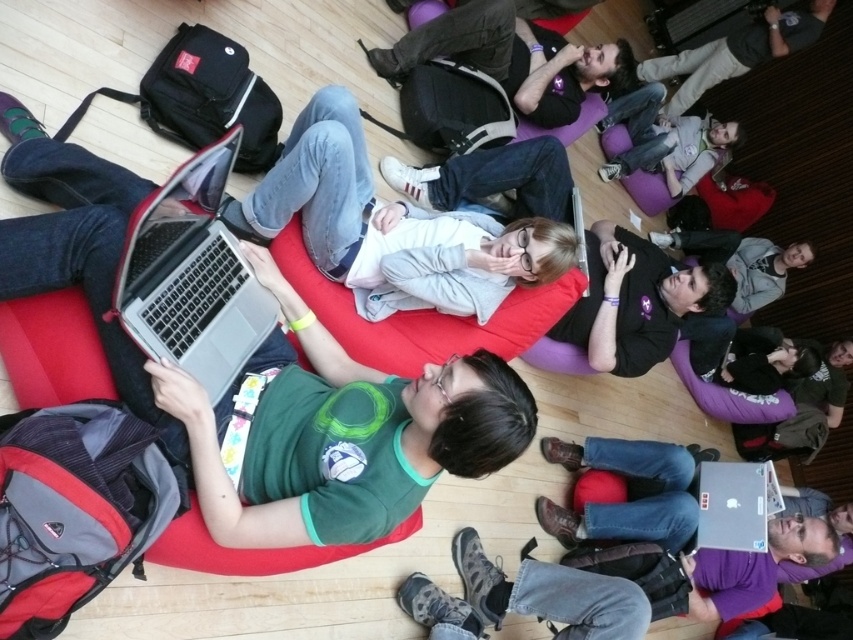
Is matte gray sweater at center closer to the viewer compared to dark gray fabric jacket at upper right?

That is True.

Can you confirm if matte gray sweater at center is positioned below dark gray fabric jacket at upper right?

Yes, matte gray sweater at center is below dark gray fabric jacket at upper right.

You are a GUI agent. You are given a task and a screenshot of the screen. Output one action in this format:
    pyautogui.click(x=<x>, y=<y>)
    Task: Click on the matte gray sweater at center
    The image size is (853, 640).
    Given the screenshot: What is the action you would take?
    pyautogui.click(x=389, y=227)

Does matte gray sweater at center have a greater width compared to matte black laptop at upper center?

No.

Which is behind, point (250, 260) or point (436, 33)?

Positioned behind is point (436, 33).

This screenshot has width=853, height=640. I want to click on matte gray sweater at center, so click(389, 227).

Identify the location of matte black laptop at upper center. (511, 58).

Between matte black laptop at upper center and dark gray fabric jacket at upper right, which one has more height?

With more height is dark gray fabric jacket at upper right.

Identify the location of matte black laptop at upper center. Image resolution: width=853 pixels, height=640 pixels. (511, 58).

You are a GUI agent. You are given a task and a screenshot of the screen. Output one action in this format:
    pyautogui.click(x=<x>, y=<y>)
    Task: Click on the matte black laptop at upper center
    
    Given the screenshot: What is the action you would take?
    pyautogui.click(x=511, y=58)